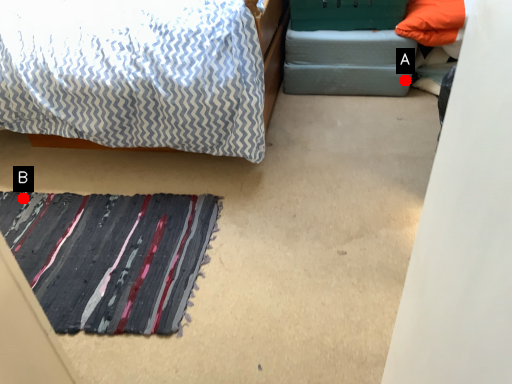
Question: Two points are circled on the image, labeled by A and B beside each circle. Which point is farther from the camera taking this photo?

Choices:
 (A) A is further
 (B) B is further

Answer: (A)